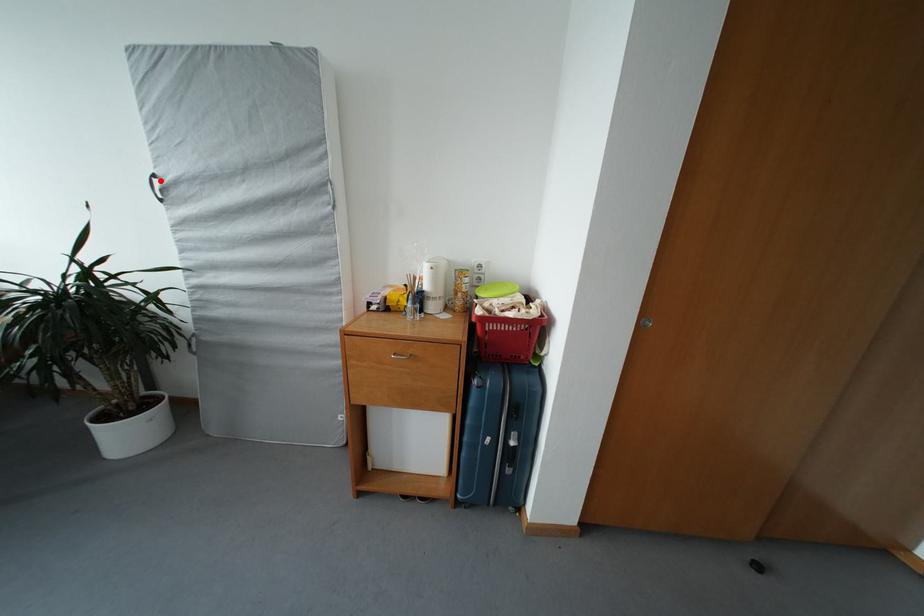
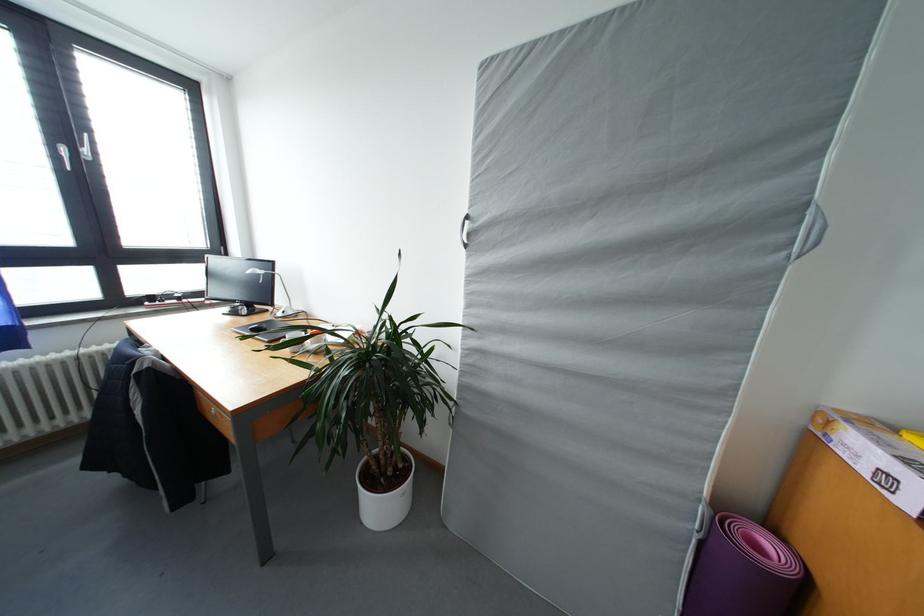
The point at the highlighted location is marked in the first image. Where is the corresponding point in the second image?

(473, 222)